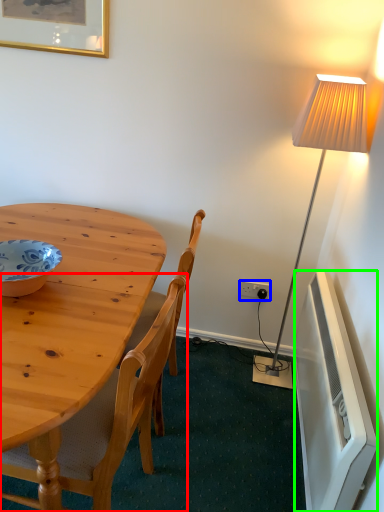
Question: Based on their relative distances, which object is farther from chair (highlighted by a red box)? Choose from power outlet (highlighted by a blue box) and radiator (highlighted by a green box).

Choices:
 (A) power outlet
 (B) radiator

Answer: (A)